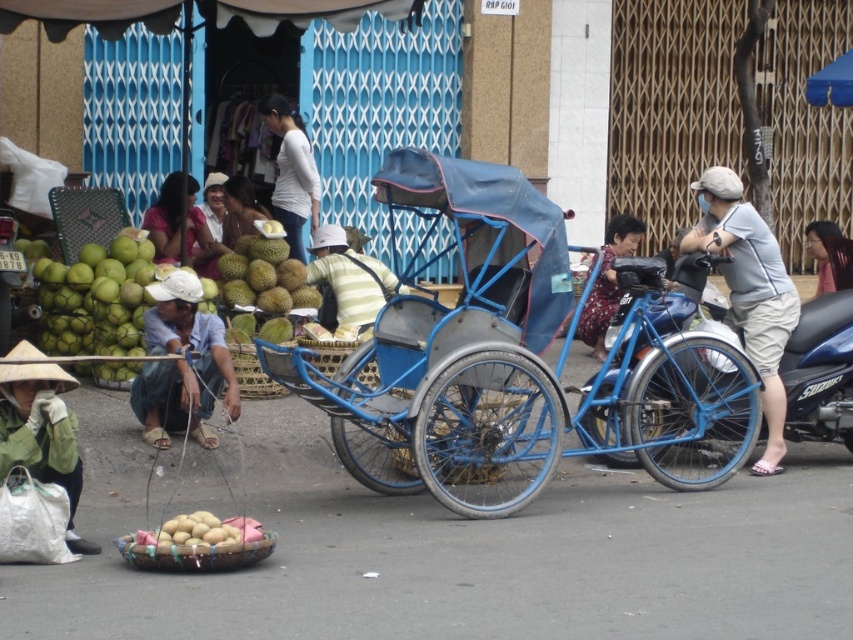
Is point (175, 412) closer to viewer compared to point (230, 212)?

Yes.

Identify the location of light blue fabric durian at lower left. (181, 364).

Does green rough durian at center appear over matte white hat at upper center?

Incorrect, green rough durian at center is not positioned above matte white hat at upper center.

Is green rough durian at center below matte white hat at upper center?

Indeed, green rough durian at center is positioned under matte white hat at upper center.

Between point (231, 282) and point (189, 195), which one is positioned behind?

Point (189, 195)

The height and width of the screenshot is (640, 853). I want to click on green rough durian at center, so click(x=263, y=278).

Does blue metallic rickshaw at center have a larger size compared to green matte coconut at left?

Yes.

The height and width of the screenshot is (640, 853). Describe the element at coordinates (511, 358) in the screenshot. I see `blue metallic rickshaw at center` at that location.

In order to click on blue metallic rickshaw at center in this screenshot , I will do `click(511, 358)`.